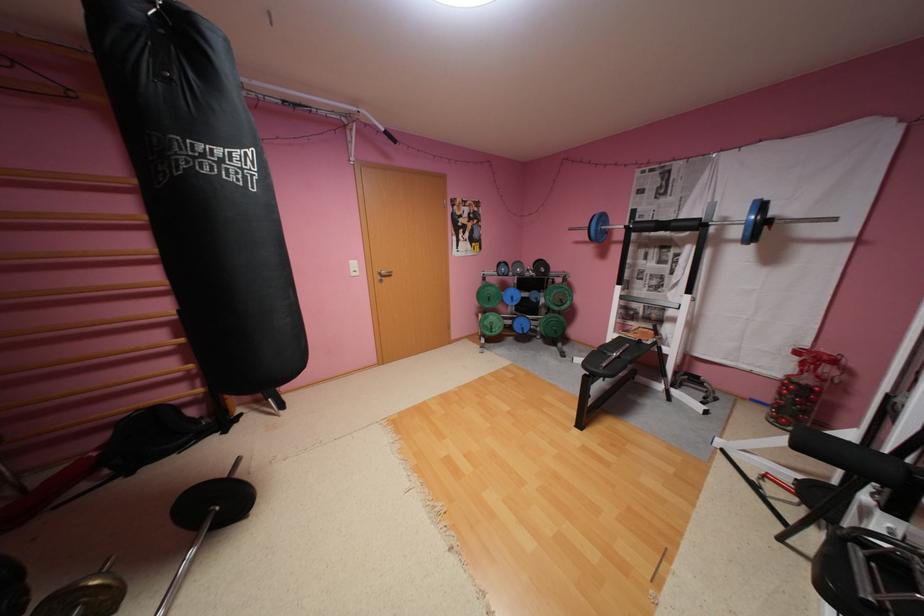
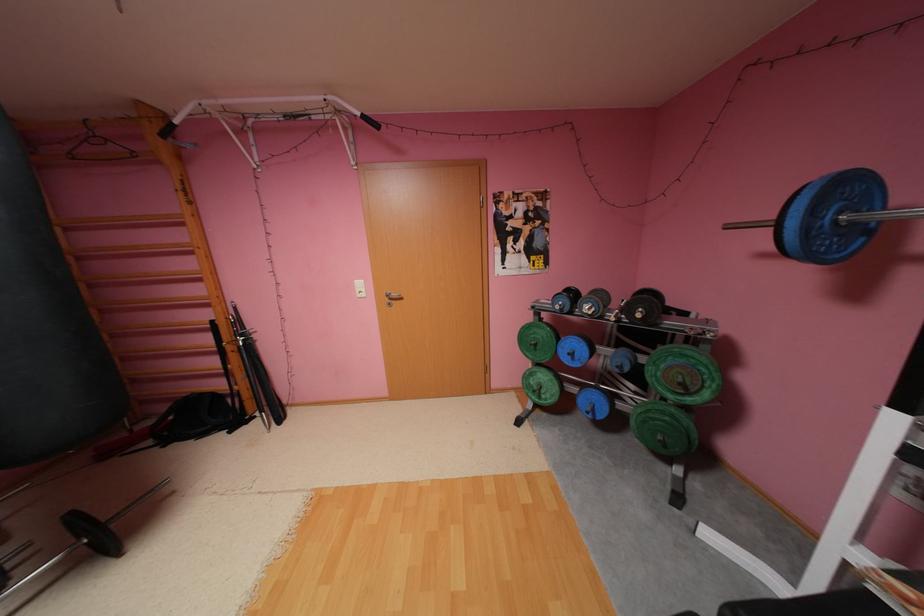
Where in the second image is the point corresponding to [604,230] from the first image?

(816, 229)